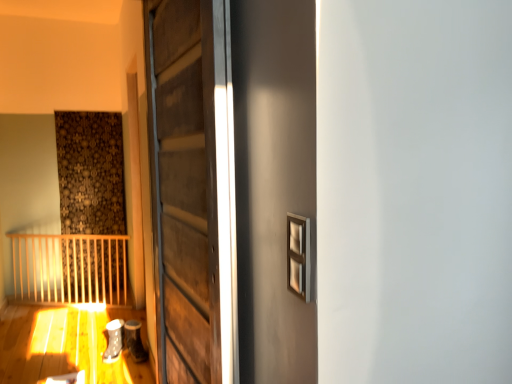
Where is `free area below matte gray shoe at lower left, the 2th shoe in the left-to-right sequence (from a real-world perspective)`? The width and height of the screenshot is (512, 384). free area below matte gray shoe at lower left, the 2th shoe in the left-to-right sequence (from a real-world perspective) is located at coordinates (134, 352).